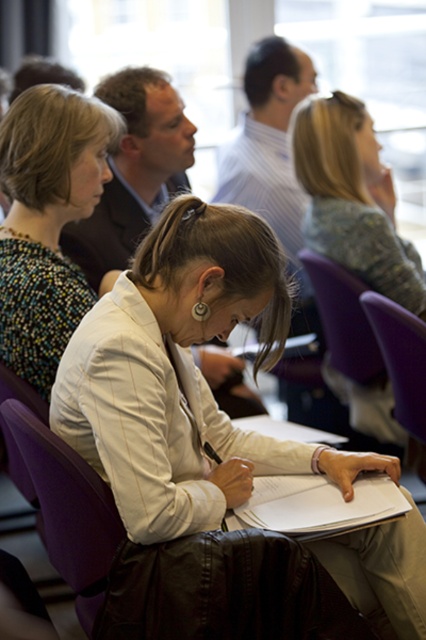
Question: Based on their relative distances, which object is nearer to the purple plastic chair at lower center?

Choices:
 (A) multicolored beaded necklace at upper left
 (B) white paper clipboard at center
 (C) purple plastic chair at center

Answer: (C)

Question: In this image, where is white paper clipboard at center located relative to purple plastic chair at center?

Choices:
 (A) left
 (B) right

Answer: (A)

Question: Does multicolored beaded necklace at upper left appear over white paper clipboard at center?

Choices:
 (A) no
 (B) yes

Answer: (B)

Question: From the image, what is the correct spatial relationship of multicolored beaded necklace at upper left in relation to purple plastic chair at center?

Choices:
 (A) below
 (B) above

Answer: (B)

Question: Which object appears closest to the camera in this image?

Choices:
 (A) purple plastic chair at lower center
 (B) multicolored beaded necklace at upper left

Answer: (B)

Question: Which point is farther to the camera?

Choices:
 (A) (419, 468)
 (B) (46, 324)

Answer: (A)